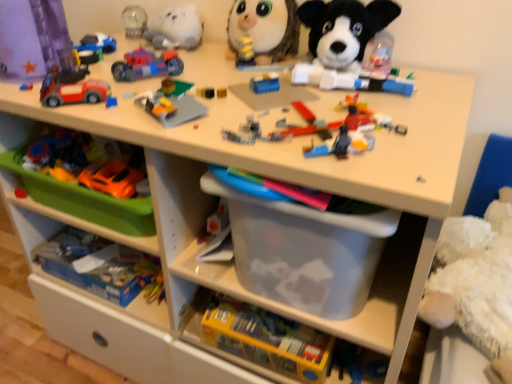
This screenshot has width=512, height=384. What are the coordinates of `vacant space to the right of soft plush dog at upper center, which is the seventh toy from bottom to top` in the screenshot? It's located at (432, 79).